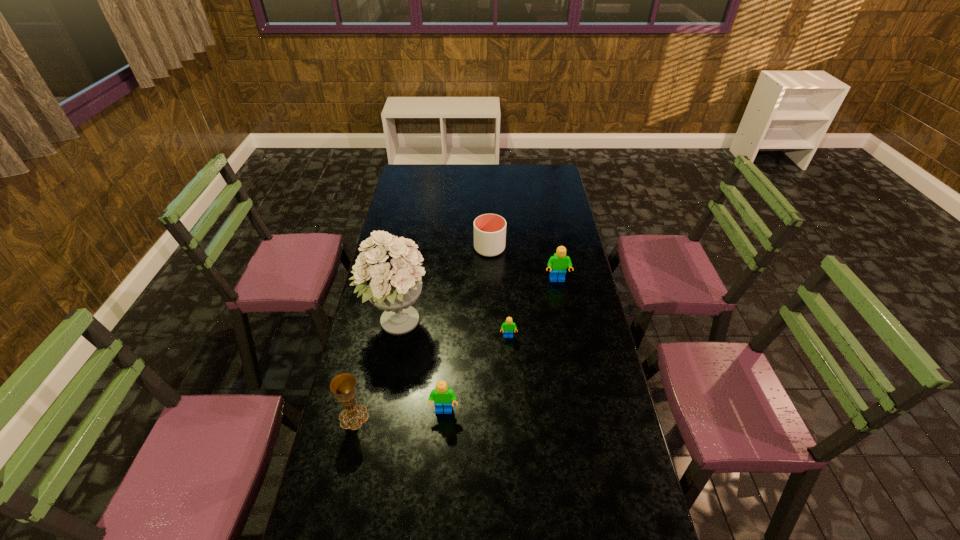
Given the evenly spaced Legos in the image, where should an extra Lego be added on the left to preserve the spacing? Please point to a vacant space. Please provide its 2D coordinates. Your answer should be formatted as a tuple, i.e. [(x, y)], where the tuple contains the x and y coordinates of a point satisfying the conditions above.

[(355, 513)]